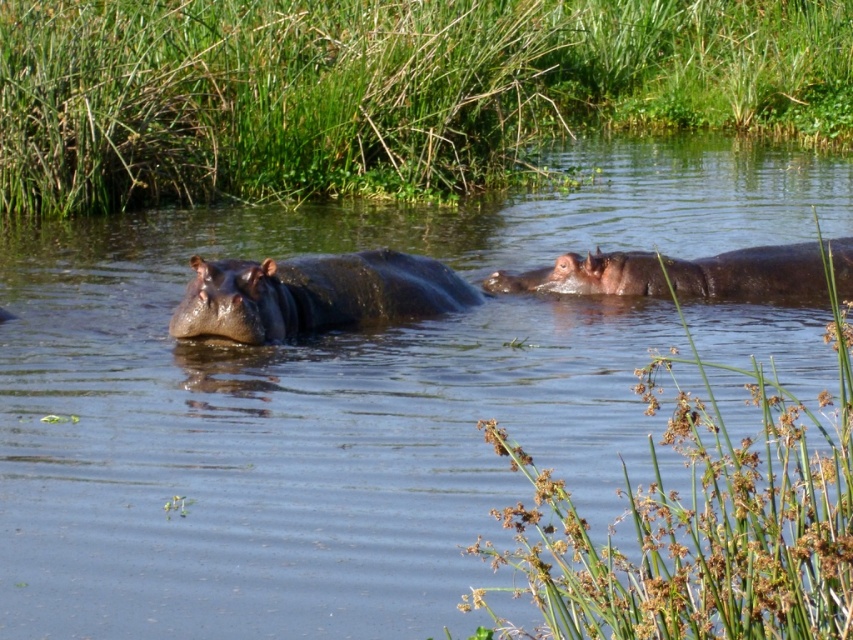
Which is behind, point (473, 93) or point (773, 253)?

Positioned behind is point (473, 93).

Does point (561, 116) lie behind point (821, 272)?

Yes.

At what (x,y) coordinates should I click in order to perform the action: click on green grass at upper center. Please return your answer as a coordinate pair (x, y). Looking at the image, I should click on (383, 90).

Identify the location of green grass at upper center. (383, 90).

Does green grass at upper center have a greater height compared to shiny brown hippo at center?

Yes, green grass at upper center is taller than shiny brown hippo at center.

Does point (422, 93) come in front of point (329, 285)?

No, (422, 93) is behind (329, 285).

This screenshot has height=640, width=853. I want to click on green grass at upper center, so click(383, 90).

Measure the distance between shiny brown hippo at center and camera.

shiny brown hippo at center and camera are 8.83 meters apart.

Between shiny brown hippo at center and brown matte hippo at right, which one has more height?

shiny brown hippo at center

Measure the distance between shiny brown hippo at center and camera.

28.98 feet

Where is `shiny brown hippo at center`? The image size is (853, 640). shiny brown hippo at center is located at coordinates (312, 294).